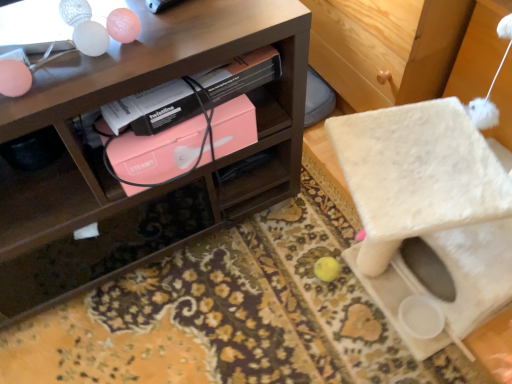
Question: Can you confirm if pink matte box at center is wider than pink matte box at center?

Choices:
 (A) yes
 (B) no

Answer: (A)

Question: Considering the relative positions of pink matte box at center and pink matte box at center in the image provided, is pink matte box at center behind pink matte box at center?

Choices:
 (A) no
 (B) yes

Answer: (B)

Question: Is pink matte box at center facing towards pink matte box at center?

Choices:
 (A) no
 (B) yes

Answer: (A)

Question: Is pink matte box at center not within pink matte box at center?

Choices:
 (A) yes
 (B) no

Answer: (A)

Question: Is pink matte box at center completely or partially inside pink matte box at center?

Choices:
 (A) no
 (B) yes

Answer: (A)

Question: Is point (132, 99) closer or farther from the camera than point (130, 140)?

Choices:
 (A) farther
 (B) closer

Answer: (B)

Question: Is pink matte box at center bigger or smaller than pink matte box at center?

Choices:
 (A) big
 (B) small

Answer: (B)

Question: In the image, is pink matte box at center positioned in front of or behind pink matte box at center?

Choices:
 (A) front
 (B) behind

Answer: (A)

Question: From the image's perspective, is pink matte box at center positioned above or below pink matte box at center?

Choices:
 (A) above
 (B) below

Answer: (A)

Question: Is point (186, 39) positioned closer to the camera than point (206, 158)?

Choices:
 (A) farther
 (B) closer

Answer: (B)

Question: Is wooden shelf at upper left in front of or behind pink matte box at center in the image?

Choices:
 (A) behind
 (B) front

Answer: (B)

Question: Is wooden shelf at upper left situated inside pink matte box at center or outside?

Choices:
 (A) outside
 (B) inside

Answer: (A)

Question: Visually, is wooden shelf at upper left positioned to the left or to the right of pink matte box at center?

Choices:
 (A) right
 (B) left

Answer: (B)

Question: Is wooden shelf at upper left inside or outside of pink matte box at center?

Choices:
 (A) inside
 (B) outside

Answer: (B)

Question: In the image, is wooden shelf at upper left positioned in front of or behind pink matte box at center?

Choices:
 (A) behind
 (B) front

Answer: (B)